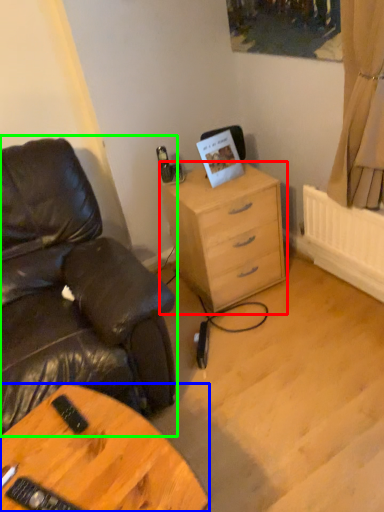
Question: Which object is positioned farthest from chest of drawers (highlighted by a red box)? Select from desk (highlighted by a blue box) and chair (highlighted by a green box).

Choices:
 (A) desk
 (B) chair

Answer: (A)